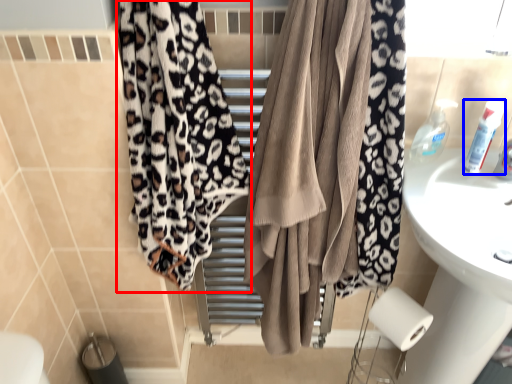
Question: Among these objects, which one is nearest to the camera, curtain (highlighted by a red box) or toiletry (highlighted by a blue box)?

Choices:
 (A) curtain
 (B) toiletry

Answer: (A)